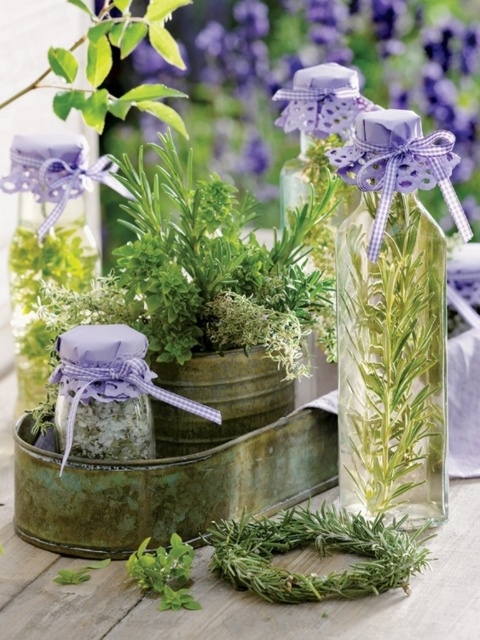
You are arranging a rustic outdoor display and need to place the matte purple glass bottle at upper center and the clear glass vase at center. According to the scene, which object is located to the left of the other?

The matte purple glass bottle at upper center is positioned on the left side of the clear glass vase at center.

You are arranging a rustic outdoor display and want to place the matte purple glass bottle at upper center and the clear glass vase at center. Based on the scene description, which object is placed above the other?

The matte purple glass bottle at upper center is positioned over clear glass vase at center, meaning it is placed above the vase.

Based on the photo, you are setting up a display on a small shelf that can only accommodate one of the items. If you have to choose between the matte purple glass bottle at upper center and the clear glass vase at center based on their sizes, which one would you choose to place on the shelf?

The matte purple glass bottle at upper center is larger in size than the clear glass vase at center, so you should choose the clear glass vase at center to place on the shelf since it is smaller and fits better.